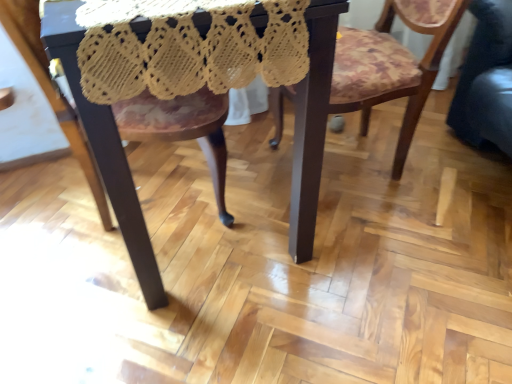
This screenshot has width=512, height=384. Find the location of `free location in front of wooden chair at center, acting as the second chair starting from the right`. free location in front of wooden chair at center, acting as the second chair starting from the right is located at coordinates (123, 310).